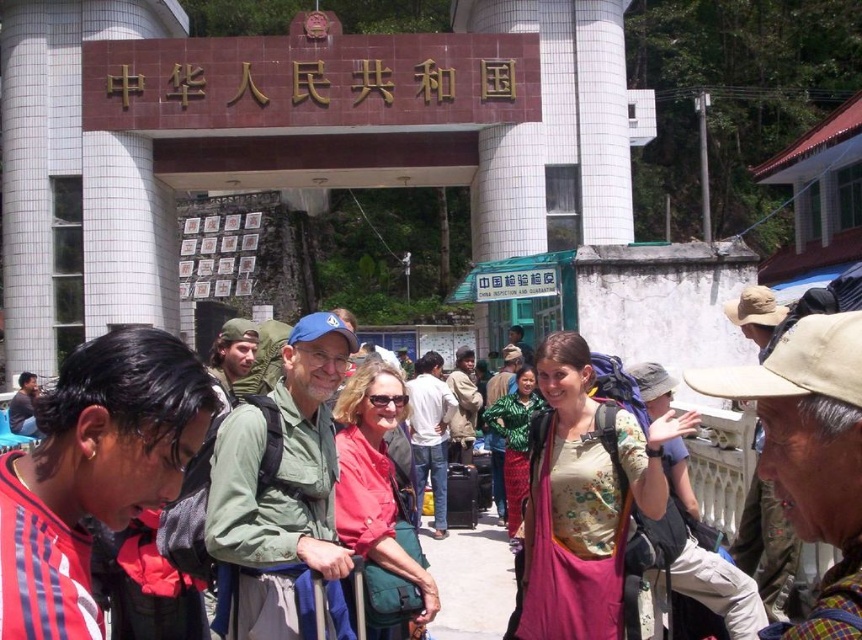
Between point (609, 490) and point (473, 404), which one is positioned behind?

Point (473, 404)

Can you confirm if floral-patterned shirt at center is bigger than khaki fabric jacket at center?

Indeed, floral-patterned shirt at center has a larger size compared to khaki fabric jacket at center.

Find the location of a particular element. Image resolution: width=862 pixels, height=640 pixels. floral-patterned shirt at center is located at coordinates (583, 499).

Is red matte jacket at center below denim jacket at center?

Actually, red matte jacket at center is above denim jacket at center.

Based on the photo, who is shorter, red matte jacket at center or denim jacket at center?

With less height is denim jacket at center.

Which is in front, point (397, 545) or point (432, 486)?

Point (397, 545)

You are a GUI agent. You are given a task and a screenshot of the screen. Output one action in this format:
    pyautogui.click(x=<x>, y=<y>)
    Task: Click on the red matte jacket at center
    The width and height of the screenshot is (862, 640).
    Given the screenshot: What is the action you would take?
    pyautogui.click(x=375, y=480)

The width and height of the screenshot is (862, 640). What do you see at coordinates (583, 499) in the screenshot? I see `floral-patterned shirt at center` at bounding box center [583, 499].

Which is in front, point (611, 572) or point (428, 360)?

Positioned in front is point (611, 572).

Is point (566, 417) farther from viewer compared to point (415, 400)?

That is False.

Where is `floral-patterned shirt at center`? The height and width of the screenshot is (640, 862). floral-patterned shirt at center is located at coordinates (583, 499).